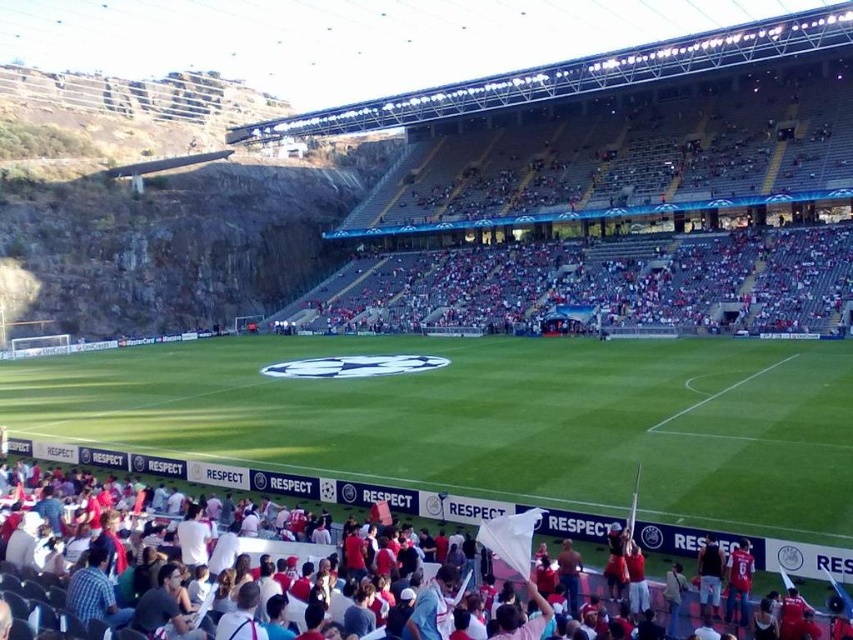
Question: Can you confirm if white fabric crowd at lower left is positioned to the right of blue jersey at lower right?

Choices:
 (A) yes
 (B) no

Answer: (B)

Question: Which point is closer to the camera?

Choices:
 (A) (844, 572)
 (B) (740, 573)

Answer: (B)

Question: Is white fabric crowd at lower left to the right of blue jersey at lower right from the viewer's perspective?

Choices:
 (A) no
 (B) yes

Answer: (A)

Question: Which of the following is the closest to the observer?

Choices:
 (A) (726, 600)
 (B) (399, 502)

Answer: (A)

Question: Does white fabric crowd at lower left appear on the left side of blue jersey at lower right?

Choices:
 (A) yes
 (B) no

Answer: (A)

Question: Which point is closer to the camera?

Choices:
 (A) white fabric crowd at lower left
 (B) blue jersey at lower right

Answer: (A)